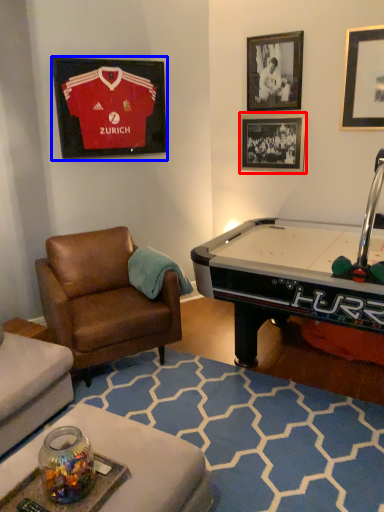
Question: Which point is further to the camera, picture frame (highlighted by a red box) or picture frame (highlighted by a blue box)?

Choices:
 (A) picture frame
 (B) picture frame

Answer: (A)